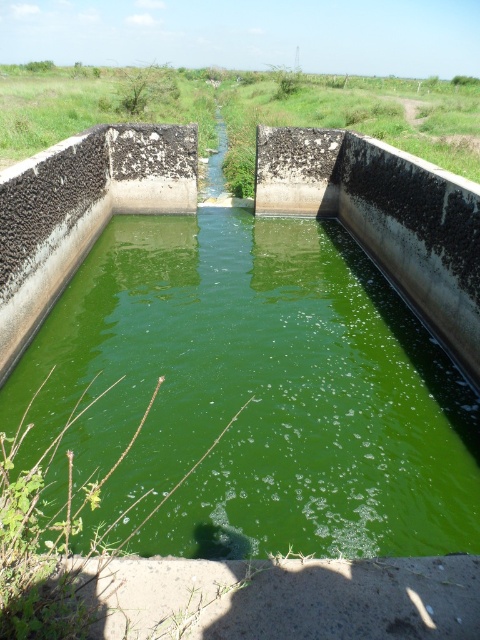
You are a drone operator tasked with capturing aerial footage of the green algae water at center. The drone has a camera with a 120 degree field of view. If you position the drone directly above the point marked by point (x=253, y=394), will the green algae water at center be fully visible within the camera frame?

The point (x=253, y=394) marks the green algae water at center, so positioning the drone directly above this point would center the camera frame on the green algae water at center. Since the camera has a 120 degree field of view, the entire green algae water at center would be visible within the frame.